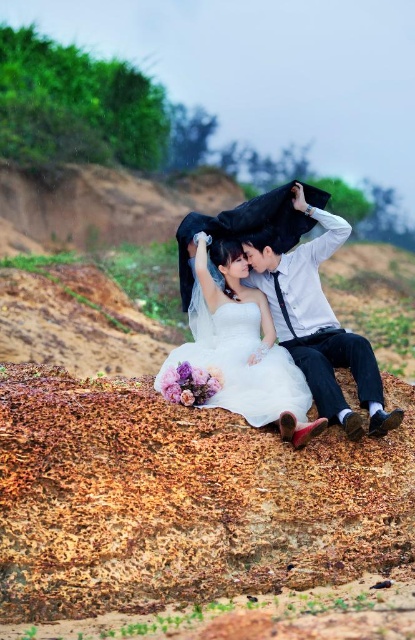
You are a photographer trying to capture a closeup of the couple without any obstructions. Since the white satin dress at center and the white satin shirt at center are both in the frame, which one should you focus on to ensure the other is not blocking the view?

The white satin dress at center is behind the white satin shirt at center, so focusing on the white satin shirt at center will ensure the dress is not blocking the view.

You are a photographer trying to capture a closeup of the couple while focusing on their clothing. Since both the white satin shirt at center and the white satin dress at center are in the frame, which one is located to the right of the other?

The white satin shirt at center is positioned on the right side of white satin dress at center.

You are a photographer trying to capture a closeup of the couple. Since the white satin shirt at center and white satin dress at center are both in the frame, which one is positioned higher in the image?

The white satin shirt at center is above the white satin dress at center, so it is positioned higher in the image.